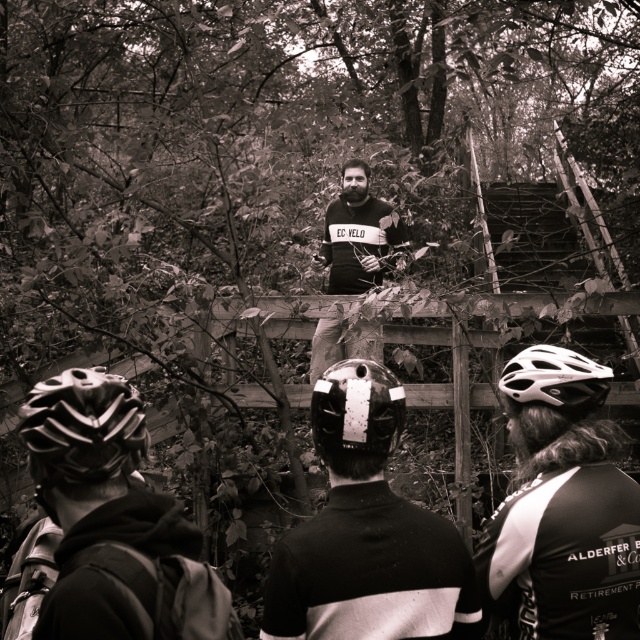
Question: Is shiny black helmet at lower left smaller than dark gray sweater at center?

Choices:
 (A) no
 (B) yes

Answer: (B)

Question: Which object is the farthest from the dark gray sweater at center?

Choices:
 (A) white matte helmet at upper center
 (B) white matte bicycle helmet at center
 (C) shiny black helmet at center
 (D) black matte helmet at center

Answer: (C)

Question: Observing the image, what is the correct spatial positioning of matte black helmet at lower left in reference to black matte helmet at center?

Choices:
 (A) above
 (B) below

Answer: (A)

Question: Which is nearer to the dark gray sweater at center?

Choices:
 (A) black matte helmet at center
 (B) shiny black helmet at lower left
 (C) white matte helmet at upper center
 (D) shiny black helmet at center

Answer: (C)

Question: Estimate the real-world distances between objects in this image. Which object is farther from the dark gray sweater at center?

Choices:
 (A) shiny black helmet at center
 (B) matte black helmet at lower left

Answer: (B)

Question: From the image, what is the correct spatial relationship of white matte helmet at upper center in relation to shiny black helmet at center?

Choices:
 (A) right
 (B) left

Answer: (A)